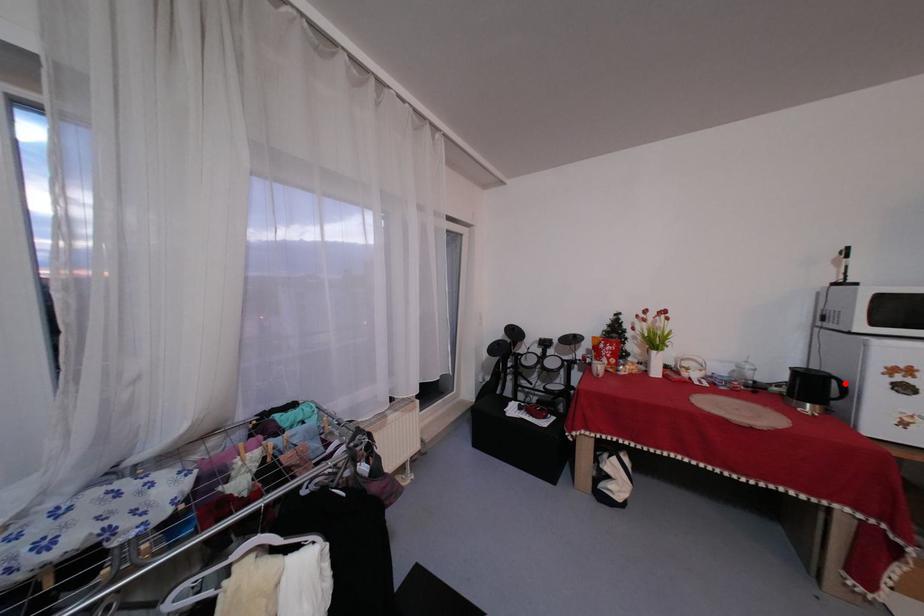
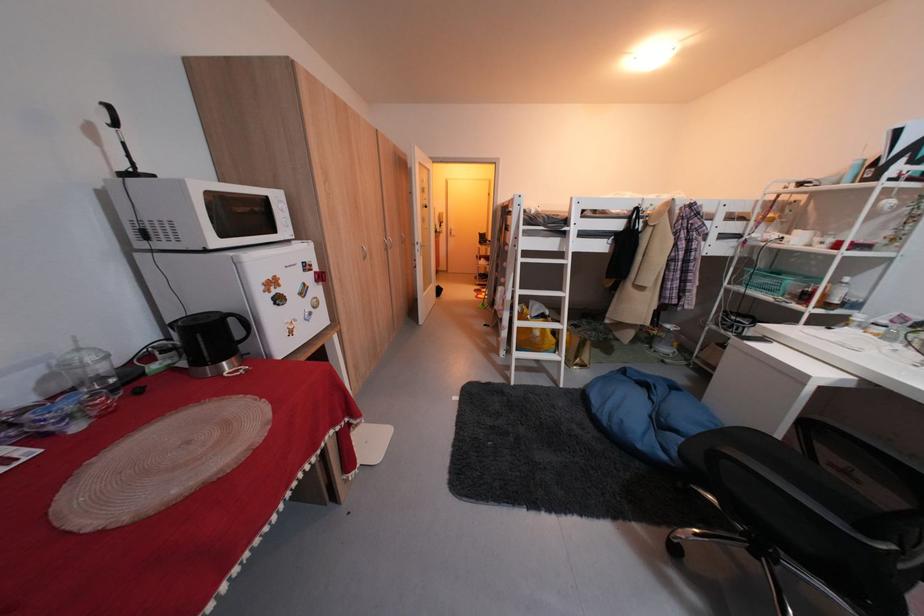
Locate, in the second image, the point that corresponds to the highlighted location in the first image.

(244, 322)